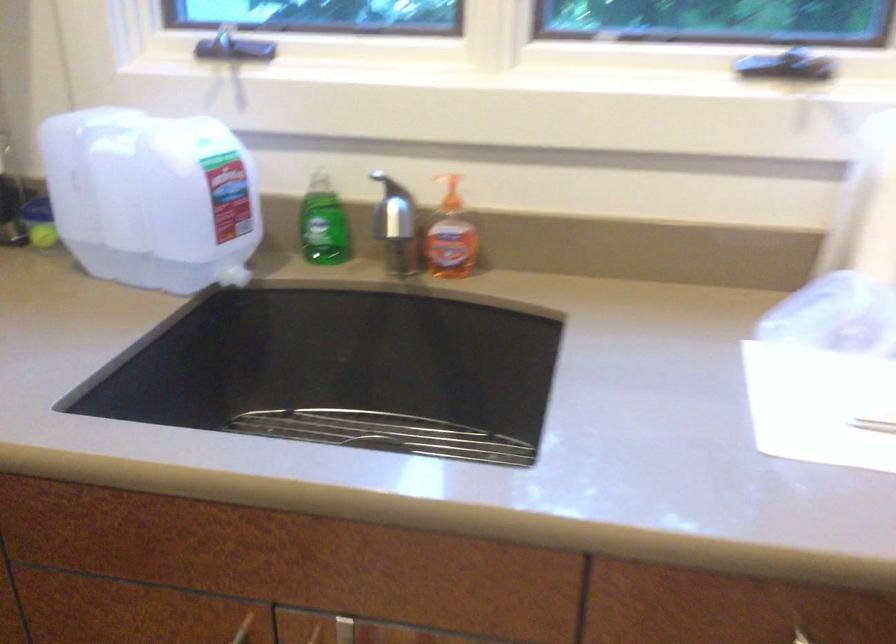
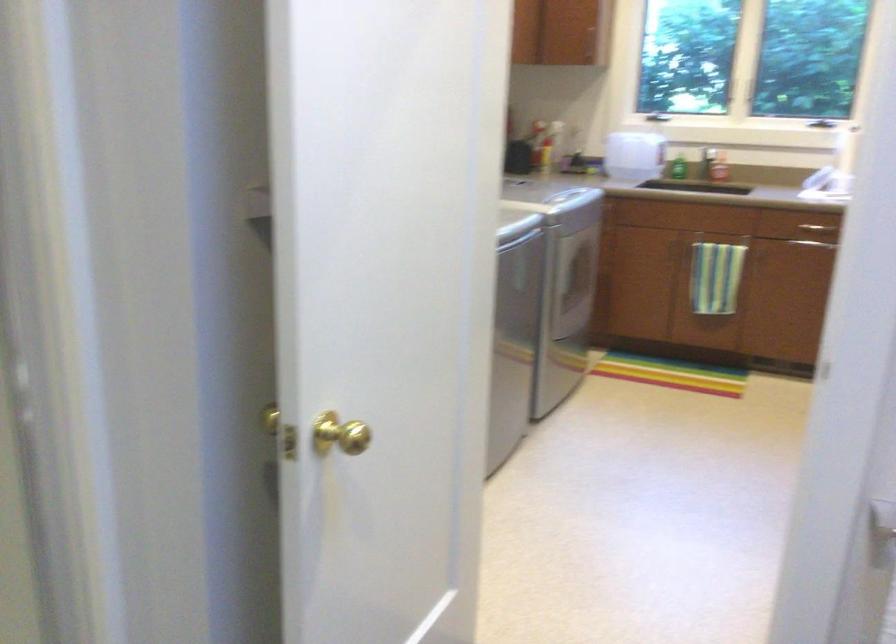
Question: Which direction would the cameraman need to move to produce the second image? Reply with the corresponding letter.

Choices:
 (A) Left
 (B) Right
 (C) Forward
 (D) Backward

Answer: (D)